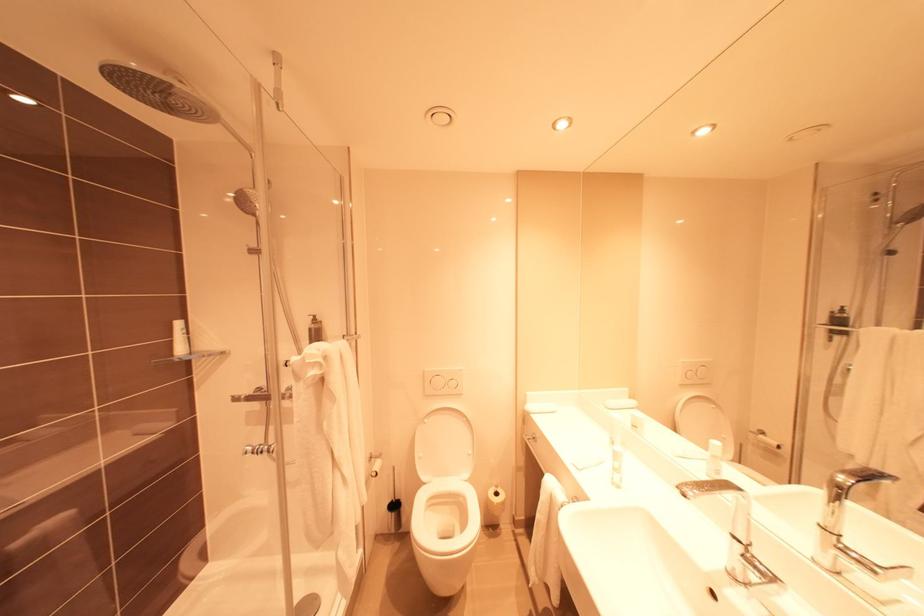
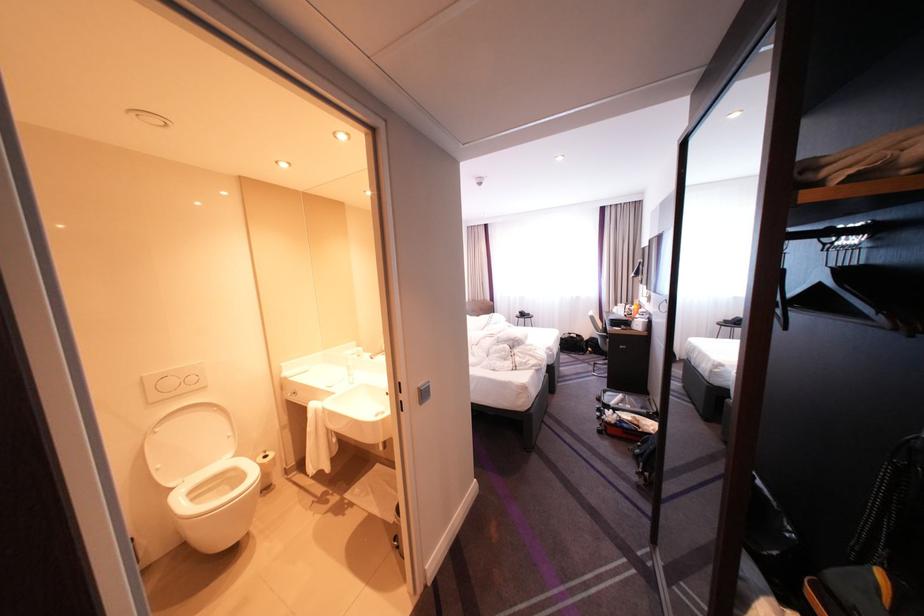
Locate, in the second image, the point that corresponds to point 435,479 in the first image.

(183, 485)